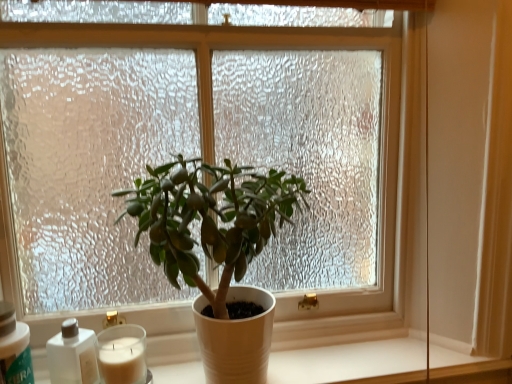
Question: Should I look upward or downward to see white plastic bottle at lower left, which ranks as the first bottle in left-to-right order?

Choices:
 (A) down
 (B) up

Answer: (A)

Question: Would you say white matte pot at center is outside white plastic bottle at lower left, which appears as the 2th bottle when viewed from the right?

Choices:
 (A) yes
 (B) no

Answer: (A)

Question: From the image's perspective, does white matte pot at center appear higher than white plastic bottle at lower left, which appears as the 2th bottle when viewed from the right?

Choices:
 (A) no
 (B) yes

Answer: (A)

Question: Is white matte pot at center thinner than white plastic bottle at lower left, which ranks as the first bottle in left-to-right order?

Choices:
 (A) no
 (B) yes

Answer: (A)

Question: Is white matte pot at center smaller than white plastic bottle at lower left, which ranks as the first bottle in left-to-right order?

Choices:
 (A) yes
 (B) no

Answer: (B)

Question: Does white matte pot at center appear on the right side of white plastic bottle at lower left, which appears as the 2th bottle when viewed from the right?

Choices:
 (A) yes
 (B) no

Answer: (A)

Question: Is white matte pot at center wider than white plastic bottle at lower left, which appears as the 2th bottle when viewed from the right?

Choices:
 (A) no
 (B) yes

Answer: (B)

Question: Is white wax candle at lower left in front of white plastic bottle at lower left, which appears as the 2th bottle when viewed from the right?

Choices:
 (A) yes
 (B) no

Answer: (B)

Question: Considering the relative sizes of white wax candle at lower left and white plastic bottle at lower left, which appears as the 2th bottle when viewed from the right, in the image provided, is white wax candle at lower left thinner than white plastic bottle at lower left, which appears as the 2th bottle when viewed from the right,?

Choices:
 (A) no
 (B) yes

Answer: (B)

Question: Is white wax candle at lower left positioned behind white plastic bottle at lower left, which appears as the 2th bottle when viewed from the right?

Choices:
 (A) no
 (B) yes

Answer: (B)

Question: From the image's perspective, is white wax candle at lower left under white plastic bottle at lower left, which appears as the 2th bottle when viewed from the right?

Choices:
 (A) yes
 (B) no

Answer: (A)

Question: Does white wax candle at lower left turn towards white plastic bottle at lower left, which ranks as the first bottle in left-to-right order?

Choices:
 (A) no
 (B) yes

Answer: (A)

Question: From a real-world perspective, is white wax candle at lower left located higher than white plastic bottle at lower left, which appears as the 2th bottle when viewed from the right?

Choices:
 (A) yes
 (B) no

Answer: (B)

Question: Is white matte bottle at lower left, positioned as the first bottle in right-to-left order, bigger than matte white pot at center?

Choices:
 (A) yes
 (B) no

Answer: (B)